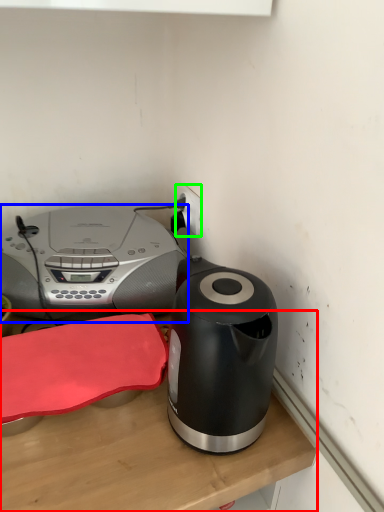
Question: Considering the real-world distances, which object is closest to table (highlighted by a red box)? home appliance (highlighted by a blue box) or electric outlet (highlighted by a green box).

Choices:
 (A) home appliance
 (B) electric outlet

Answer: (A)